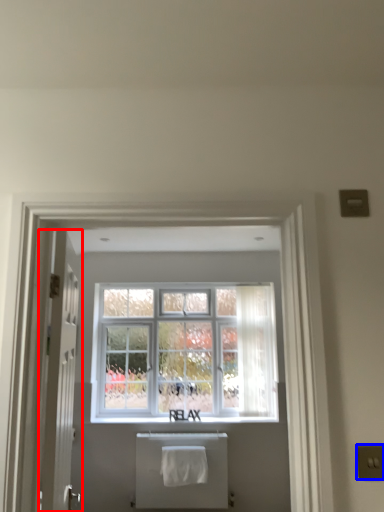
Question: Which object appears closest to the camera in this image, door (highlighted by a red box) or electric outlet (highlighted by a blue box)?

Choices:
 (A) door
 (B) electric outlet

Answer: (B)